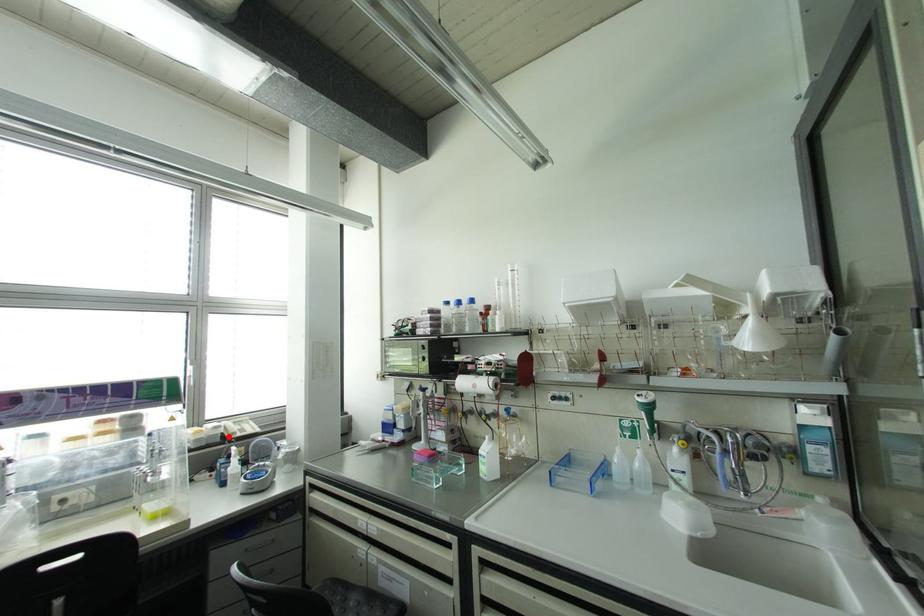
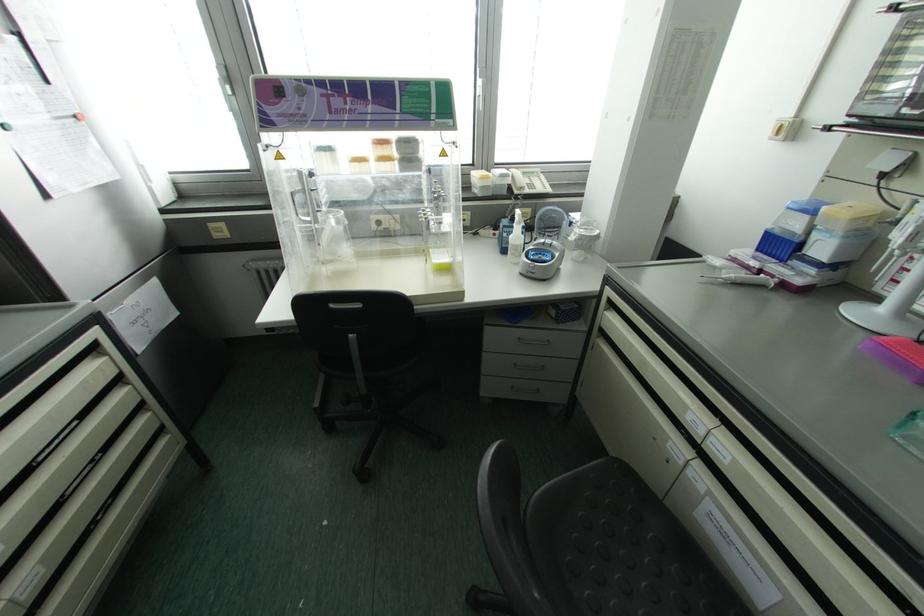
Locate, in the second image, the point that corresponds to the highlighted location in the first image.

(515, 191)